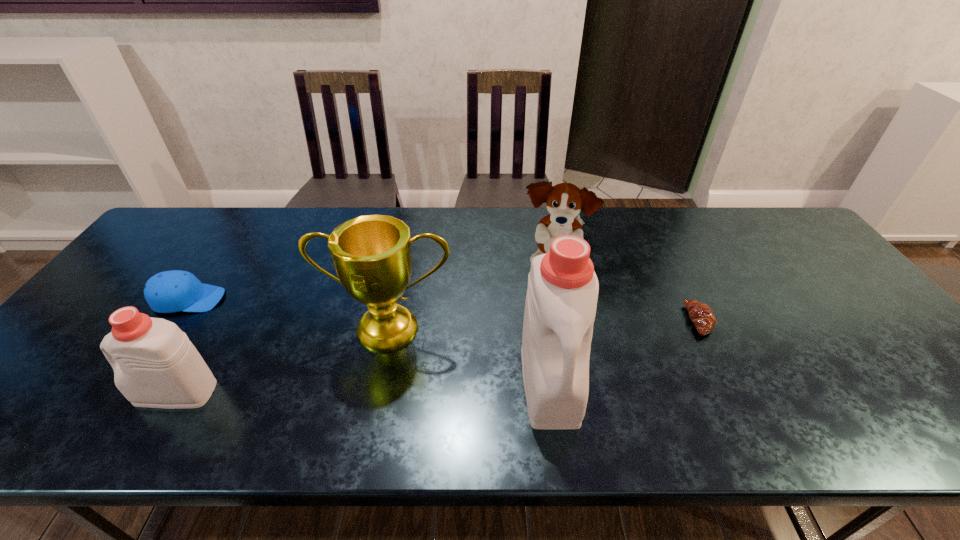
In the current image, all detergents are evenly spaced. To maintain this equal spacing, where should an additional detergent be placed on the right? Please point out a free spot. Please provide its 2D coordinates. Your answer should be formatted as a tuple, i.e. [(x, y)], where the tuple contains the x and y coordinates of a point satisfying the conditions above.

[(909, 372)]